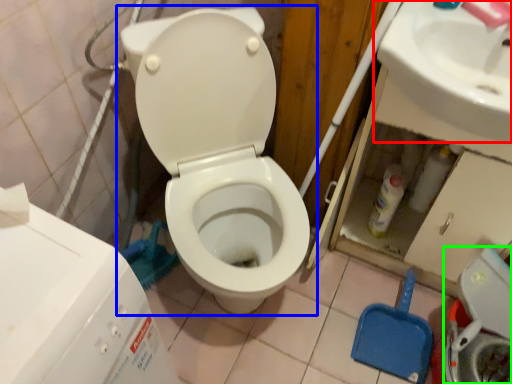
Question: Which object is positioned closest to sink (highlighted by a red box)? Select from toilet (highlighted by a blue box) and washer (highlighted by a green box).

Choices:
 (A) toilet
 (B) washer

Answer: (A)